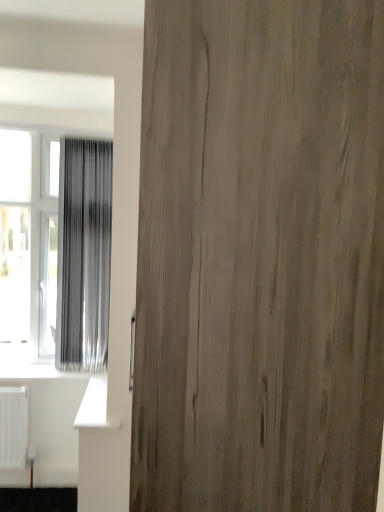
Question: Does wooden door at center touch silvery metallic curtain at left?

Choices:
 (A) yes
 (B) no

Answer: (B)

Question: Could you tell me if wooden door at center is facing silvery metallic curtain at left?

Choices:
 (A) yes
 (B) no

Answer: (B)

Question: From a real-world perspective, does wooden door at center sit lower than silvery metallic curtain at left?

Choices:
 (A) yes
 (B) no

Answer: (A)

Question: From the image's perspective, is wooden door at center over silvery metallic curtain at left?

Choices:
 (A) no
 (B) yes

Answer: (A)

Question: From a real-world perspective, does wooden door at center stand above silvery metallic curtain at left?

Choices:
 (A) yes
 (B) no

Answer: (B)

Question: Is wooden door at center taller than silvery metallic curtain at left?

Choices:
 (A) yes
 (B) no

Answer: (A)

Question: Does silvery metallic curtain at left have a smaller size compared to transparent plastic window at left?

Choices:
 (A) yes
 (B) no

Answer: (A)

Question: Is silvery metallic curtain at left bigger than transparent plastic window at left?

Choices:
 (A) no
 (B) yes

Answer: (A)

Question: Can you confirm if silvery metallic curtain at left is shorter than transparent plastic window at left?

Choices:
 (A) yes
 (B) no

Answer: (A)

Question: Is silvery metallic curtain at left in contact with transparent plastic window at left?

Choices:
 (A) no
 (B) yes

Answer: (A)

Question: From the image's perspective, is silvery metallic curtain at left under transparent plastic window at left?

Choices:
 (A) yes
 (B) no

Answer: (B)

Question: Is silvery metallic curtain at left to the right of transparent plastic window at left from the viewer's perspective?

Choices:
 (A) yes
 (B) no

Answer: (A)

Question: Could you tell me if silvery metallic curtain at left is turned towards wooden door at center?

Choices:
 (A) yes
 (B) no

Answer: (B)